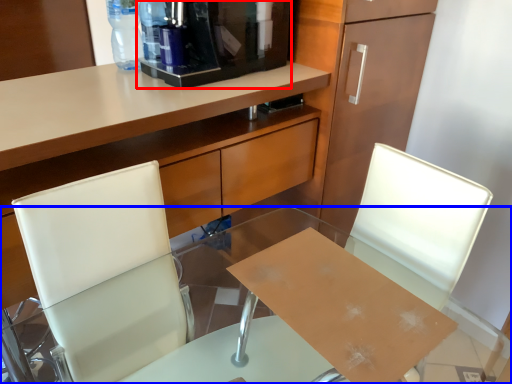
Question: Which object is further to the camera taking this photo, coffee machine (highlighted by a red box) or desk (highlighted by a blue box)?

Choices:
 (A) coffee machine
 (B) desk

Answer: (A)